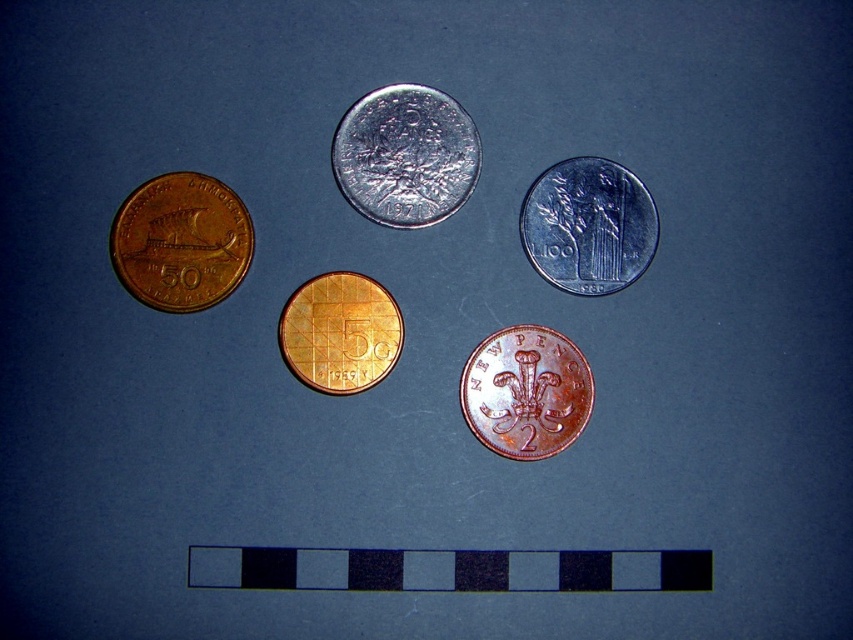
You are holding a camera and want to take a photo of the satin silver coin at upper right. If the camera is currently positioned 4.13 feet away from the coin, is this distance within the recommended 4 feet focus range for closeup photography?

The satin silver coin at upper right and camera are 4.13 feet apart from each other. Since the recommended focus range is 4 feet, the distance is slightly beyond the optimal range for closeup photography.

You are a collector who wants to place a new coin between the shiny silver coin at center and the matte gold coin at left. The new coin has a diameter of 1.5 inches. Can the new coin fit in the space between them without overlapping either coin?

The shiny silver coin at center and the matte gold coin at left are 7.36 inches apart. Since the new coin has a diameter of 1.5 inches, the minimum distance required to place it between them without overlapping would be twice the radius of the new coin plus the distance between the centers of the existing coins. However, since the existing coins are already 7.36 inches apart, which is much larger than the new coin diameter, there is sufficient space to place the new coin between them without overlapping.